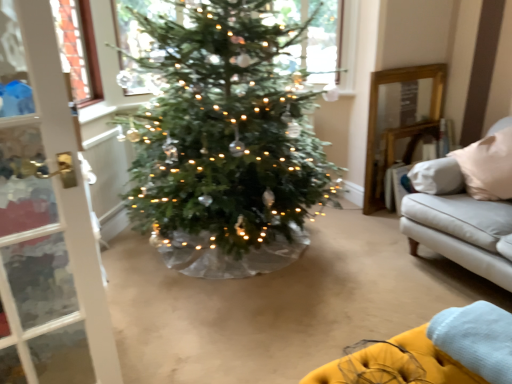
Locate an element on the screen. velvet yellow couch at lower right is located at coordinates (432, 352).

The image size is (512, 384). What are the coordinates of `clear glass window at upper center` in the screenshot? It's located at (311, 38).

In the scene shown: From a real-world perspective, which is physically below, yellow fabric blanket at lower right or clear glass window at upper center?

yellow fabric blanket at lower right, from a real-world perspective.

Is yellow fabric blanket at lower right bigger or smaller than clear glass window at upper center?

Considering their sizes, yellow fabric blanket at lower right takes up less space than clear glass window at upper center.

Which of these two, yellow fabric blanket at lower right or clear glass window at upper center, is wider?

yellow fabric blanket at lower right.

From the image's perspective, is yellow fabric blanket at lower right above clear glass window at upper center?

No, from the image's perspective, yellow fabric blanket at lower right is not on top of clear glass window at upper center.

Is point (424, 343) closer to viewer compared to point (332, 26)?

Yes.

Considering the sizes of objects velvet yellow couch at lower right and clear glass window at upper center in the image provided, who is shorter, velvet yellow couch at lower right or clear glass window at upper center?

velvet yellow couch at lower right.

Relative to clear glass window at upper center, is velvet yellow couch at lower right in front or behind?

Clearly, velvet yellow couch at lower right is in front of clear glass window at upper center.

Identify the location of couch below the clear glass window at upper center (from the image's perspective). This screenshot has height=384, width=512. (432, 352).

Does clear glass window at upper center have a lesser width compared to velvet yellow couch at lower right?

Yes.

Is point (280, 10) positioned in front of point (349, 374)?

No, it is not.

Does clear glass window at upper center have a greater height compared to velvet yellow couch at lower right?

Correct, clear glass window at upper center is much taller as velvet yellow couch at lower right.

Is velvet yellow couch at lower right looking in the opposite direction of yellow fabric blanket at lower right?

No, velvet yellow couch at lower right's orientation is not away from yellow fabric blanket at lower right.

Which object is further away from the camera, velvet yellow couch at lower right or yellow fabric blanket at lower right?

yellow fabric blanket at lower right is more distant.

Is velvet yellow couch at lower right positioned far away from yellow fabric blanket at lower right?

No, velvet yellow couch at lower right is not far from yellow fabric blanket at lower right.

Between yellow fabric blanket at lower right and velvet yellow couch at lower right, which one has less height?

yellow fabric blanket at lower right is shorter.

Based on the photo, considering the relative sizes of yellow fabric blanket at lower right and velvet yellow couch at lower right in the image provided, is yellow fabric blanket at lower right bigger than velvet yellow couch at lower right?

Incorrect, yellow fabric blanket at lower right is not larger than velvet yellow couch at lower right.

How much distance is there between clear glass window at upper center and yellow fabric blanket at lower right?

They are 2.36 meters apart.

From a real-world perspective, which is physically below, clear glass window at upper center or yellow fabric blanket at lower right?

In real-world perspective, yellow fabric blanket at lower right is lower.

Is clear glass window at upper center not within yellow fabric blanket at lower right?

Yes.

Is clear glass window at upper center not close to yellow fabric blanket at lower right?

clear glass window at upper center is positioned a significant distance from yellow fabric blanket at lower right.

The height and width of the screenshot is (384, 512). In order to click on window to the left of yellow fabric blanket at lower right in this screenshot , I will do `click(311, 38)`.

Where is `window above the velvet yellow couch at lower right (from a real-world perspective)`? window above the velvet yellow couch at lower right (from a real-world perspective) is located at coordinates (311, 38).

Looking at this image, considering their positions, is velvet yellow couch at lower right positioned closer to clear glass window at upper center than yellow fabric blanket at lower right?

yellow fabric blanket at lower right is closer to clear glass window at upper center.

Which object lies further to the anchor point velvet yellow couch at lower right, clear glass window at upper center or yellow fabric blanket at lower right?

clear glass window at upper center is further to velvet yellow couch at lower right.

Estimate the real-world distances between objects in this image. Which object is further from clear glass window at upper center, yellow fabric blanket at lower right or velvet yellow couch at lower right?

velvet yellow couch at lower right.

Based on the photo, estimate the real-world distances between objects in this image. Which object is closer to yellow fabric blanket at lower right, velvet yellow couch at lower right or clear glass window at upper center?

velvet yellow couch at lower right is closer to yellow fabric blanket at lower right.

Which object lies further to the anchor point velvet yellow couch at lower right, yellow fabric blanket at lower right or clear glass window at upper center?

Result: clear glass window at upper center.

Looking at the image, which one is located further to yellow fabric blanket at lower right, clear glass window at upper center or velvet yellow couch at lower right?

clear glass window at upper center.

Image resolution: width=512 pixels, height=384 pixels. What are the coordinates of `blanket between velvet yellow couch at lower right and clear glass window at upper center in the front-back direction` in the screenshot? It's located at (476, 339).